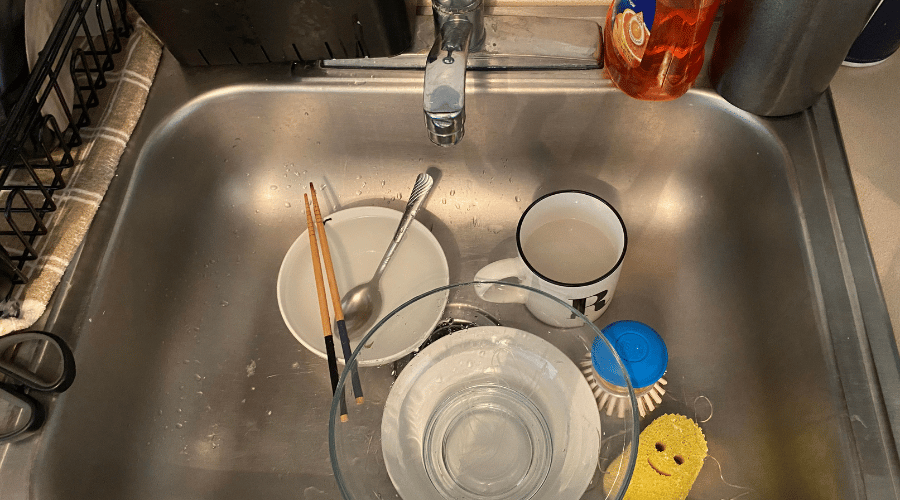
Find the location of a particular element. This screenshot has width=900, height=500. dish scrubs is located at coordinates (645, 355), (688, 467).